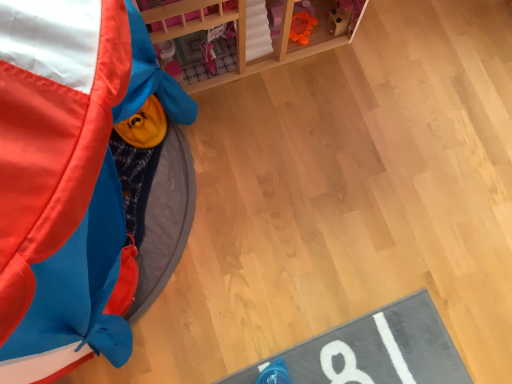
Question: Is wooden dollhouse at upper center wider or thinner than rubberized yellow toy at upper left?

Choices:
 (A) wide
 (B) thin

Answer: (B)

Question: Is wooden dollhouse at upper center to the left or to the right of rubberized yellow toy at upper left in the image?

Choices:
 (A) left
 (B) right

Answer: (B)

Question: From a real-world perspective, is wooden dollhouse at upper center above or below rubberized yellow toy at upper left?

Choices:
 (A) below
 (B) above

Answer: (A)

Question: Considering the positions of point (8, 109) and point (322, 49), is point (8, 109) closer or farther from the camera than point (322, 49)?

Choices:
 (A) closer
 (B) farther

Answer: (A)

Question: From a real-world perspective, is rubberized yellow toy at upper left physically located above or below wooden dollhouse at upper center?

Choices:
 (A) below
 (B) above

Answer: (B)

Question: Is rubberized yellow toy at upper left bigger or smaller than wooden dollhouse at upper center?

Choices:
 (A) big
 (B) small

Answer: (A)

Question: Considering the positions of rubberized yellow toy at upper left and wooden dollhouse at upper center in the image, is rubberized yellow toy at upper left taller or shorter than wooden dollhouse at upper center?

Choices:
 (A) tall
 (B) short

Answer: (A)